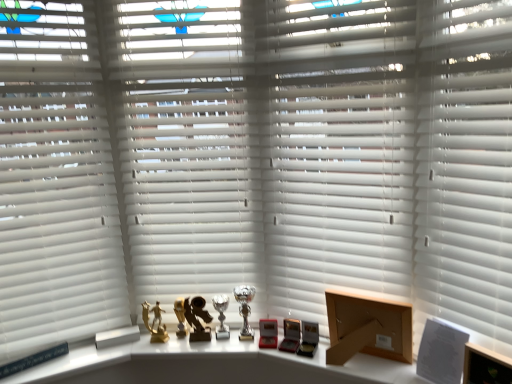
Question: In which direction should I rotate to look at white matte blinds at center, the 2th shutter positioned from the left?

Choices:
 (A) left
 (B) right

Answer: (B)

Question: Would you say gold metallic figurine at center, placed as the 1th toy when sorted from left to right, is a long distance from white matte shutter at center, positioned as the 1th shutter in right-to-left order?

Choices:
 (A) yes
 (B) no

Answer: (A)

Question: Can you confirm if gold metallic figurine at center, placed as the 1th toy when sorted from left to right, is thinner than white matte shutter at center, positioned as the 1th shutter in right-to-left order?

Choices:
 (A) yes
 (B) no

Answer: (A)

Question: Does gold metallic figurine at center, placed as the 1th toy when sorted from left to right, have a greater width compared to white matte shutter at center, positioned as the 1th shutter in right-to-left order?

Choices:
 (A) no
 (B) yes

Answer: (A)

Question: Considering the relative positions of gold metallic figurine at center, placed as the 1th toy when sorted from left to right, and white matte shutter at center, positioned as the 1th shutter in right-to-left order, in the image provided, is gold metallic figurine at center, placed as the 1th toy when sorted from left to right, to the right of white matte shutter at center, positioned as the 1th shutter in right-to-left order, from the viewer's perspective?

Choices:
 (A) yes
 (B) no

Answer: (B)

Question: Is gold metallic figurine at center, placed as the 1th toy when sorted from left to right, taller than white matte shutter at center, positioned as the 1th shutter in right-to-left order?

Choices:
 (A) yes
 (B) no

Answer: (B)

Question: From a real-world perspective, is gold metallic figurine at center, placed as the 1th toy when sorted from left to right, on top of white matte shutter at center, the third shutter viewed from the left?

Choices:
 (A) yes
 (B) no

Answer: (B)

Question: Are white matte blinds at center, the 2th shutter positioned from the left, and white matte blinds at left far apart?

Choices:
 (A) yes
 (B) no

Answer: (B)

Question: Could you tell me if white matte blinds at center, the 2th shutter positioned from the left, is facing white matte blinds at left?

Choices:
 (A) no
 (B) yes

Answer: (A)

Question: Is the depth of white matte blinds at center, the 2th shutter positioned from the left, less than that of white matte blinds at left?

Choices:
 (A) no
 (B) yes

Answer: (B)

Question: From the image's perspective, is white matte blinds at center, positioned as the 2th shutter in right-to-left order, located beneath white matte blinds at left?

Choices:
 (A) yes
 (B) no

Answer: (B)

Question: From the image's perspective, is white matte blinds at center, the 2th shutter positioned from the left, above white matte blinds at left?

Choices:
 (A) yes
 (B) no

Answer: (A)

Question: Considering the relative sizes of white matte blinds at center, positioned as the 2th shutter in right-to-left order, and white matte blinds at left in the image provided, is white matte blinds at center, positioned as the 2th shutter in right-to-left order, taller than white matte blinds at left?

Choices:
 (A) no
 (B) yes

Answer: (A)

Question: Is gold metallic trophy at center far from white matte blinds at center, positioned as the 2th shutter in right-to-left order?

Choices:
 (A) yes
 (B) no

Answer: (B)